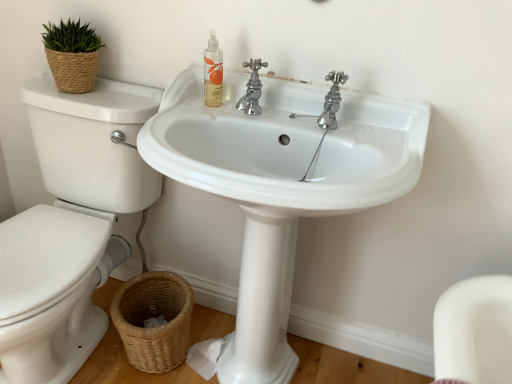
I want to click on vacant region to the left of woven brown basket at lower left, so click(x=93, y=351).